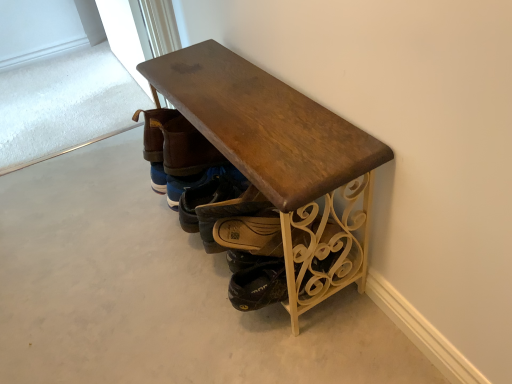
Locate an element on the screen. This screenshot has width=512, height=384. free space on the front side of brown leather shoes at center, acting as the first footwear starting from the front is located at coordinates (252, 340).